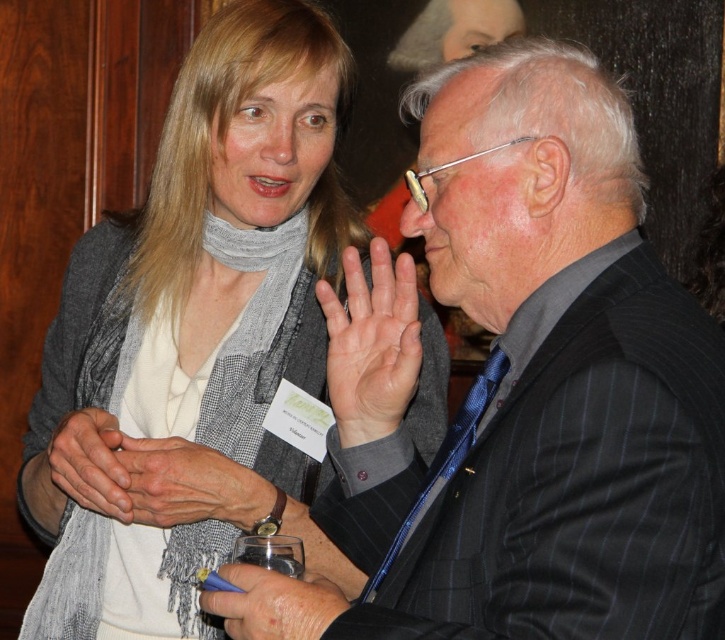
Question: Does dry skin palm at center come behind smooth beige scarf at center?

Choices:
 (A) no
 (B) yes

Answer: (A)

Question: Is smooth skin hand at center bigger than smooth beige scarf at lower left?

Choices:
 (A) no
 (B) yes

Answer: (A)

Question: Which point is farther to the camera?

Choices:
 (A) matte black suit at center
 (B) smooth skin hand at center

Answer: (B)

Question: Which point is closer to the camera?

Choices:
 (A) (125, 448)
 (B) (294, 632)
 (C) (460, 285)

Answer: (B)

Question: Which point is farther to the camera?

Choices:
 (A) matte black suit at center
 (B) smooth beige scarf at lower left
 (C) matte gray scarf at center
 (D) smooth beige scarf at center

Answer: (C)

Question: Does matte gray scarf at center appear over smooth beige scarf at center?

Choices:
 (A) yes
 (B) no

Answer: (A)